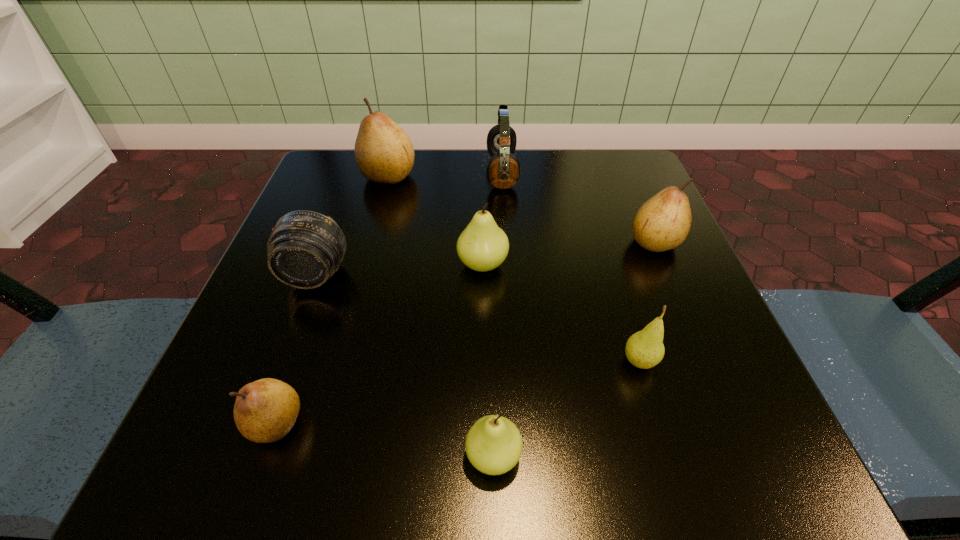
Image resolution: width=960 pixels, height=540 pixels. Identify the location of vacant space in between the rightmost object and the smallest brown pear. (465, 332).

At what (x,y) coordinates should I click in order to perform the action: click on free spot between the seventh object from left to right and the bigger green pear. Please return your answer as a coordinate pair (x, y). Looking at the image, I should click on pyautogui.click(x=561, y=313).

Find the location of a particular element. free area in between the headset and the smaller green pear is located at coordinates (497, 314).

Identify the location of vacant point located between the bigger green pear and the fifth pear from left to right. (561, 313).

Identify which object is located as the second nearest to the farther green pear. Please provide its 2D coordinates. Your answer should be formatted as a tuple, i.e. [(x, y)], where the tuple contains the x and y coordinates of a point satisfying the conditions above.

[(305, 248)]

Where is `object identified as the fifth closest to the nearer green pear`? This screenshot has width=960, height=540. object identified as the fifth closest to the nearer green pear is located at coordinates (663, 222).

Identify the location of pear that is the fifth closest to the farthest brown pear. (493, 445).

Image resolution: width=960 pixels, height=540 pixels. Find the location of `the fifth closest pear to the nearer green pear`. the fifth closest pear to the nearer green pear is located at coordinates (384, 153).

Where is `the second closest brown pear to the headset`? This screenshot has height=540, width=960. the second closest brown pear to the headset is located at coordinates (663, 222).

Find the location of a particular element. the second closest brown pear to the farthest pear is located at coordinates (265, 410).